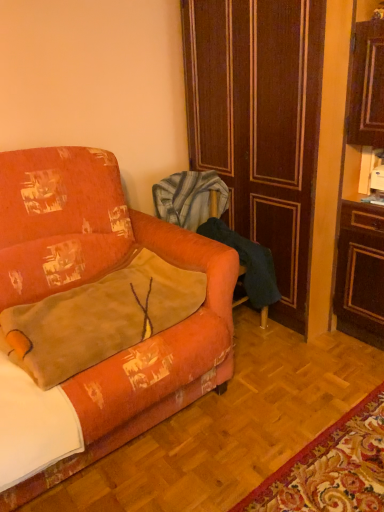
Question: Is orange fabric couch at left situated inside velvet orange throw pillow at lower left or outside?

Choices:
 (A) inside
 (B) outside

Answer: (B)

Question: From their relative heights in the image, would you say orange fabric couch at left is taller or shorter than velvet orange throw pillow at lower left?

Choices:
 (A) short
 (B) tall

Answer: (B)

Question: Estimate the real-world distances between objects in this image. Which object is closer to the orange fabric couch at left?

Choices:
 (A) brown wood door at center
 (B) velvet orange throw pillow at lower left
 (C) velvet orange armchair at center

Answer: (B)

Question: Which of these objects is positioned closest to the velvet orange armchair at center?

Choices:
 (A) brown wood door at center
 (B) orange fabric couch at left
 (C) velvet orange throw pillow at lower left

Answer: (A)